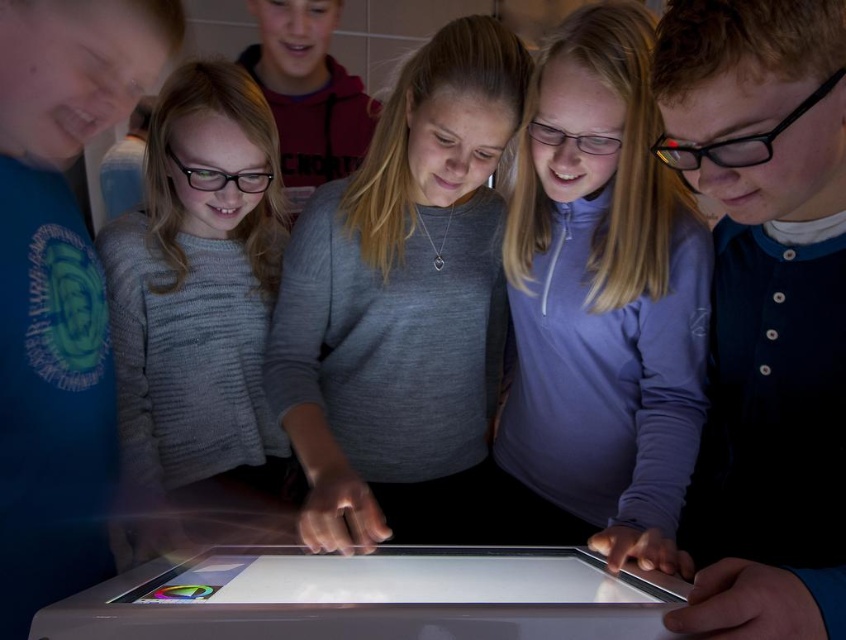
Does point (762, 630) come closer to viewer compared to point (685, 369)?

Yes, it is.

Based on the photo, is matte black glasses at center positioned before purple fleece jacket at center?

Yes, it is.

The width and height of the screenshot is (846, 640). I want to click on matte black glasses at center, so click(765, 307).

Is point (185, 236) positioned behind point (411, 579)?

Yes, it is.

Which of these two, knitted gray sweater at center or silver metallic tablet at center, stands taller?

knitted gray sweater at center

Which is in front, point (201, 465) or point (503, 588)?

Point (503, 588) is in front.

Identify the location of knitted gray sweater at center. (194, 300).

Is gray sweater at center further to the viewer compared to knitted gray sweater at center?

No, it is in front of knitted gray sweater at center.

Where is `gray sweater at center`? gray sweater at center is located at coordinates (400, 298).

Between point (471, 369) and point (244, 200), which one is positioned in front?

Point (471, 369) is more forward.

Where is `gray sweater at center`? This screenshot has height=640, width=846. gray sweater at center is located at coordinates (400, 298).